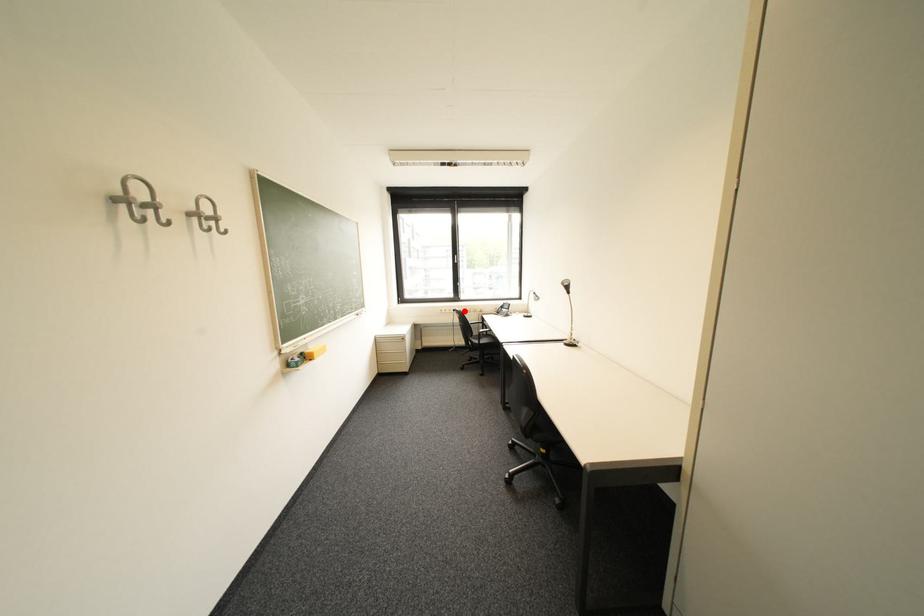
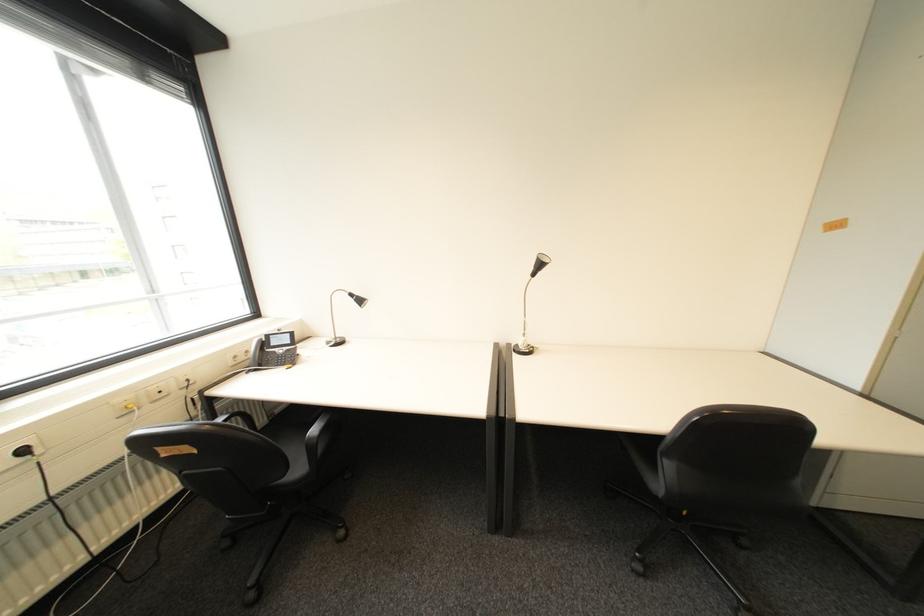
The point at the highlighted location is marked in the first image. Where is the corresponding point in the second image?

(34, 452)